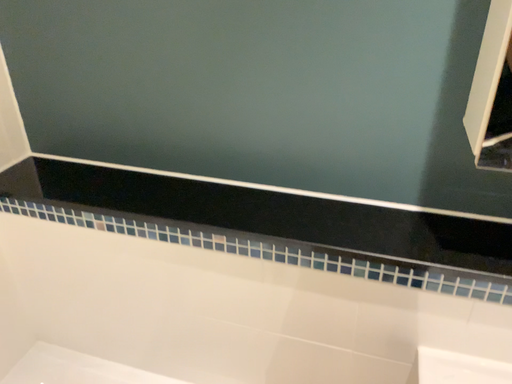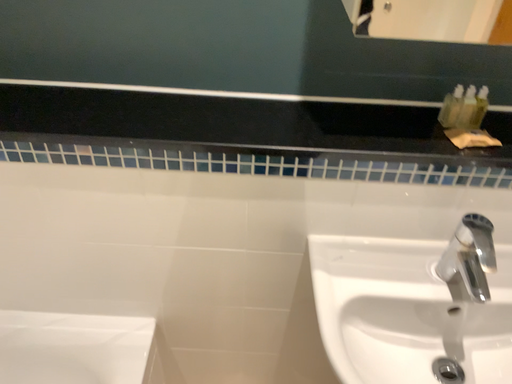
Question: Which way did the camera rotate in the video?

Choices:
 (A) rotated upward
 (B) rotated downward

Answer: (B)